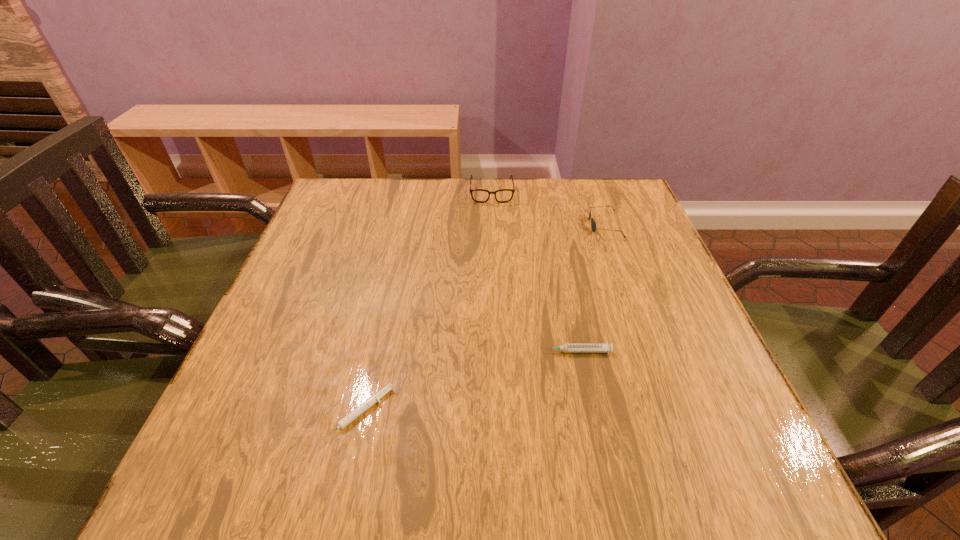
You are a GUI agent. You are given a task and a screenshot of the screen. Output one action in this format:
    pyautogui.click(x=<x>, y=<y>)
    Task: Click on the free space that satisfies the following two spatial constraints: 1. on the lenses of the third nearest object; 2. on the front side of the shorter syringe
    Image resolution: width=960 pixels, height=540 pixels.
    Given the screenshot: What is the action you would take?
    [x=673, y=414]

This screenshot has width=960, height=540. I want to click on free spot that satisfies the following two spatial constraints: 1. at the needle end of the right syringe; 2. on the front side of the leftmost object, so coord(588,414).